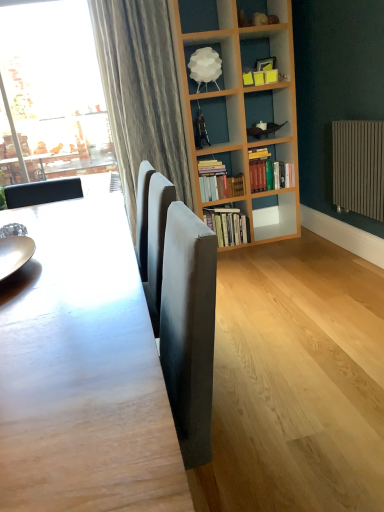
Find the location of a particular element. This screenshot has height=512, width=384. free spot below hardcover books at center, the third book in the bottom-to-top sequence (from a real-world perspective) is located at coordinates (270, 234).